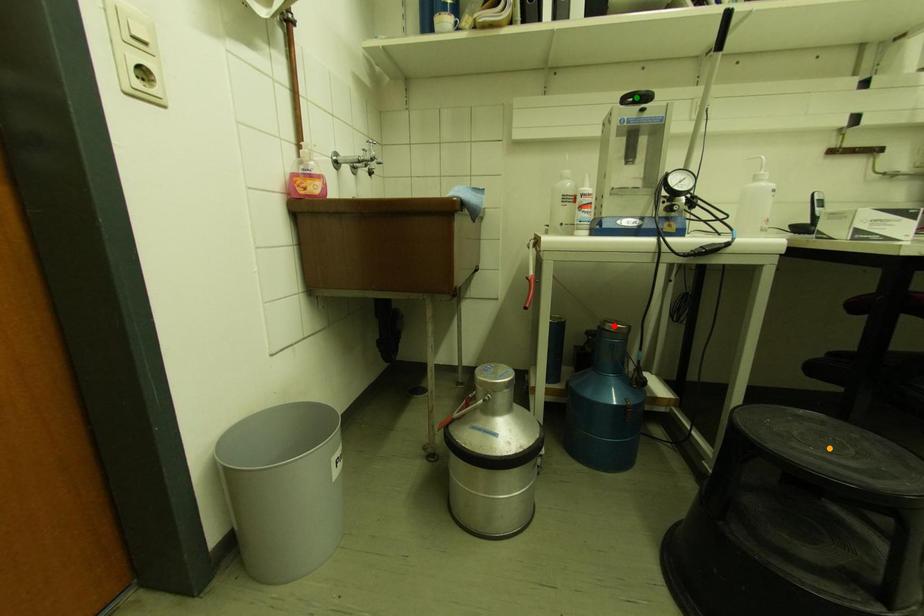
Order these from farthest to nearest:
red point, green point, orange point

red point
green point
orange point